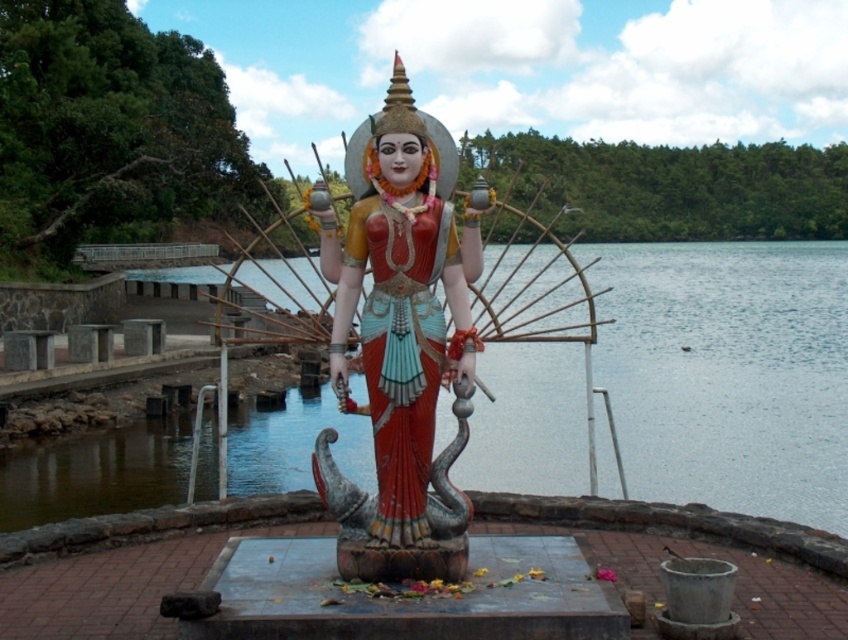
You are a sculptor who wants to place a new decorative item between the polished bronze statue at center and the polished wood statue at center. What is the minimum space required between them to ensure the item fits?

The polished bronze statue at center and the polished wood statue at center are 13.10 inches apart from each other. Therefore, the minimum space needed for the decorative item is at least 13.10 inches.

You are a photographer standing at the edge of the water. You want to capture a closeup shot of the clear water at statue center. Based on the coordinates provided, where should you position your camera relative to the statue?

The clear water at statue center is located at coordinates point 0.584 on the x axis and 0.861 on the y axis. To capture this, position the camera slightly to the right of the statue center and lower down to align with these coordinates.